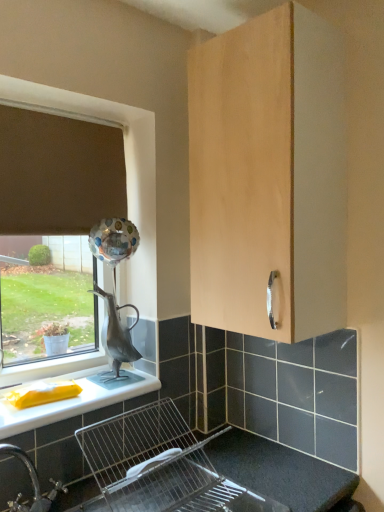
Describe the element at coordinates (268, 175) in the screenshot. The width and height of the screenshot is (384, 512). I see `light wood cabinet at upper center` at that location.

In order to face metallic silver sink at lower center, should I rotate leftwards or rightwards?

A 1.640 degree turn to the left will do.

This screenshot has height=512, width=384. I want to click on brown fabric curtain at upper left, so click(x=58, y=173).

The image size is (384, 512). What do you see at coordinates (58, 173) in the screenshot?
I see `brown fabric curtain at upper left` at bounding box center [58, 173].

Locate an element on the screen. The height and width of the screenshot is (512, 384). light wood cabinet at upper center is located at coordinates point(268,175).

Which is more to the right, white glossy countertop at lower left or metallic silver sink at lower center?

metallic silver sink at lower center is more to the right.

From a real-world perspective, between white glossy countertop at lower left and metallic silver sink at lower center, who is vertically lower?

From a 3D spatial view, metallic silver sink at lower center is below.

This screenshot has width=384, height=512. I want to click on countertop lying on the left of metallic silver sink at lower center, so click(x=71, y=401).

Which point is more forward, (21, 419) or (190, 508)?

The point (190, 508) is more forward.

Based on the photo, from the image's perspective, which is below, light wood cabinet at upper center or white glossy countertop at lower left?

white glossy countertop at lower left, from the image's perspective.

Are light wood cabinet at upper center and white glossy countertop at lower left far apart?

No, light wood cabinet at upper center is not far away from white glossy countertop at lower left.

Does point (340, 41) come in front of point (107, 402)?

Yes, point (340, 41) is in front of point (107, 402).

Consider the image. Which of these two, light wood cabinet at upper center or white glossy countertop at lower left, is bigger?

With larger size is light wood cabinet at upper center.

Is point (226, 96) positioned behind point (60, 228)?

No, it is not.

Considering the relative positions of light wood cabinet at upper center and brown fabric curtain at upper left in the image provided, is light wood cabinet at upper center to the left or to the right of brown fabric curtain at upper left?

Based on their positions, light wood cabinet at upper center is located to the right of brown fabric curtain at upper left.

How far apart are light wood cabinet at upper center and brown fabric curtain at upper left?

light wood cabinet at upper center is 20.79 inches away from brown fabric curtain at upper left.

In terms of size, does light wood cabinet at upper center appear bigger or smaller than brown fabric curtain at upper left?

Considering their sizes, light wood cabinet at upper center takes up more space than brown fabric curtain at upper left.

Can you confirm if brown fabric curtain at upper left is positioned to the right of light wood cabinet at upper center?

No, brown fabric curtain at upper left is not to the right of light wood cabinet at upper center.

Based on the photo, from the image's perspective, is brown fabric curtain at upper left located above light wood cabinet at upper center?

Yes, from the image's perspective, brown fabric curtain at upper left is above light wood cabinet at upper center.

Can you confirm if metallic silver sink at lower center is bigger than brown fabric curtain at upper left?

Yes.

From the image's perspective, is metallic silver sink at lower center over brown fabric curtain at upper left?

Incorrect, from the image's perspective, metallic silver sink at lower center is lower than brown fabric curtain at upper left.

Can you see metallic silver sink at lower center touching brown fabric curtain at upper left?

metallic silver sink at lower center and brown fabric curtain at upper left are not in contact.

From a real-world perspective, is metallic silver sink at lower center positioned over brown fabric curtain at upper left based on gravity?

No.

Would you say metallic silver sink at lower center contains white glossy countertop at lower left?

No.

In the scene shown: Can you confirm if metallic silver sink at lower center is taller than white glossy countertop at lower left?

Indeed, metallic silver sink at lower center has a greater height compared to white glossy countertop at lower left.

Based on the photo, considering the sizes of metallic silver sink at lower center and white glossy countertop at lower left in the image, is metallic silver sink at lower center wider or thinner than white glossy countertop at lower left?

In the image, metallic silver sink at lower center appears to be wider than white glossy countertop at lower left.

You are a GUI agent. You are given a task and a screenshot of the screen. Output one action in this format:
    pyautogui.click(x=<x>, y=<y>)
    Task: Click on the cabinetry that appears above the white glossy countertop at lower left (from the image's perspective)
    
    Given the screenshot: What is the action you would take?
    pyautogui.click(x=268, y=175)

Looking at this image, is white glossy countertop at lower left completely or partially outside of light wood cabinet at upper center?

Absolutely, white glossy countertop at lower left is external to light wood cabinet at upper center.

From a real-world perspective, relative to light wood cabinet at upper center, is white glossy countertop at lower left vertically above or below?

From a real-world perspective, white glossy countertop at lower left is physically below light wood cabinet at upper center.

Which object is closer to the camera taking this photo, white glossy countertop at lower left or light wood cabinet at upper center?

Positioned in front is light wood cabinet at upper center.

Find the location of a particular element. The height and width of the screenshot is (512, 384). countertop that is on the left side of metallic silver sink at lower center is located at coordinates (71, 401).

Locate an element on the screen. This screenshot has height=512, width=384. countertop that is under the light wood cabinet at upper center (from a real-world perspective) is located at coordinates (71, 401).

When comparing their distances from metallic silver sink at lower center, does white glossy countertop at lower left or brown fabric curtain at upper left seem closer?

white glossy countertop at lower left lies closer to metallic silver sink at lower center than the other object.

Based on their spatial positions, is metallic silver sink at lower center or white glossy countertop at lower left closer to light wood cabinet at upper center?

metallic silver sink at lower center lies closer to light wood cabinet at upper center than the other object.

Based on their spatial positions, is light wood cabinet at upper center or white glossy countertop at lower left further from brown fabric curtain at upper left?

Based on the image, white glossy countertop at lower left appears to be further to brown fabric curtain at upper left.

Considering their positions, is white glossy countertop at lower left positioned closer to light wood cabinet at upper center than brown fabric curtain at upper left?

The object closer to light wood cabinet at upper center is brown fabric curtain at upper left.

From the image, which object appears to be nearer to white glossy countertop at lower left, metallic silver sink at lower center or light wood cabinet at upper center?

Among the two, metallic silver sink at lower center is located nearer to white glossy countertop at lower left.

Which object lies further to the anchor point metallic silver sink at lower center, brown fabric curtain at upper left or white glossy countertop at lower left?

Among the two, brown fabric curtain at upper left is located further to metallic silver sink at lower center.

Considering their positions, is brown fabric curtain at upper left positioned closer to metallic silver sink at lower center than light wood cabinet at upper center?

light wood cabinet at upper center is positioned closer to the anchor metallic silver sink at lower center.

Estimate the real-world distances between objects in this image. Which object is further from white glossy countertop at lower left, brown fabric curtain at upper left or light wood cabinet at upper center?

light wood cabinet at upper center lies further to white glossy countertop at lower left than the other object.

At what (x,y) coordinates should I click in order to perform the action: click on countertop between light wood cabinet at upper center and metallic silver sink at lower center in the up-down direction. Please return your answer as a coordinate pair (x, y). This screenshot has height=512, width=384. Looking at the image, I should click on tap(71, 401).

At what (x,y) coordinates should I click in order to perform the action: click on cabinetry between brown fabric curtain at upper left and metallic silver sink at lower center in the up-down direction. Please return your answer as a coordinate pair (x, y). The width and height of the screenshot is (384, 512). Looking at the image, I should click on (268, 175).

In order to click on cabinetry between brown fabric curtain at upper left and white glossy countertop at lower left in the vertical direction in this screenshot , I will do `click(268, 175)`.

Locate an element on the screen. Image resolution: width=384 pixels, height=512 pixels. countertop that lies between brown fabric curtain at upper left and metallic silver sink at lower center from top to bottom is located at coordinates (71, 401).